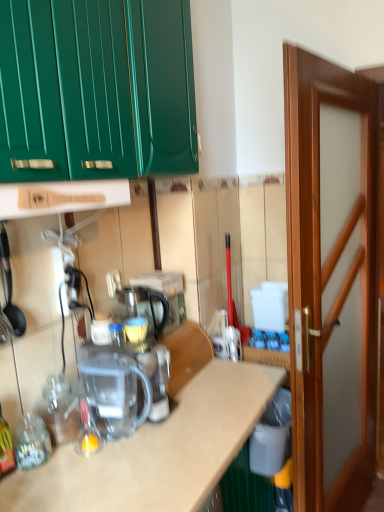
Locate an element on the screen. vacant space to the right of translucent glass bottle at lower left, marked as the second bottle in a right-to-left arrangement is located at coordinates (57, 474).